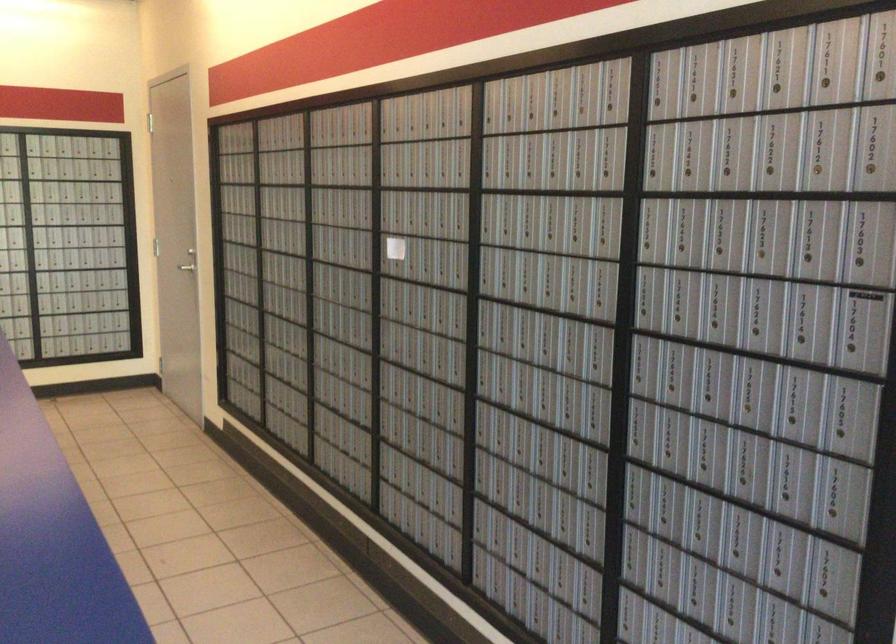
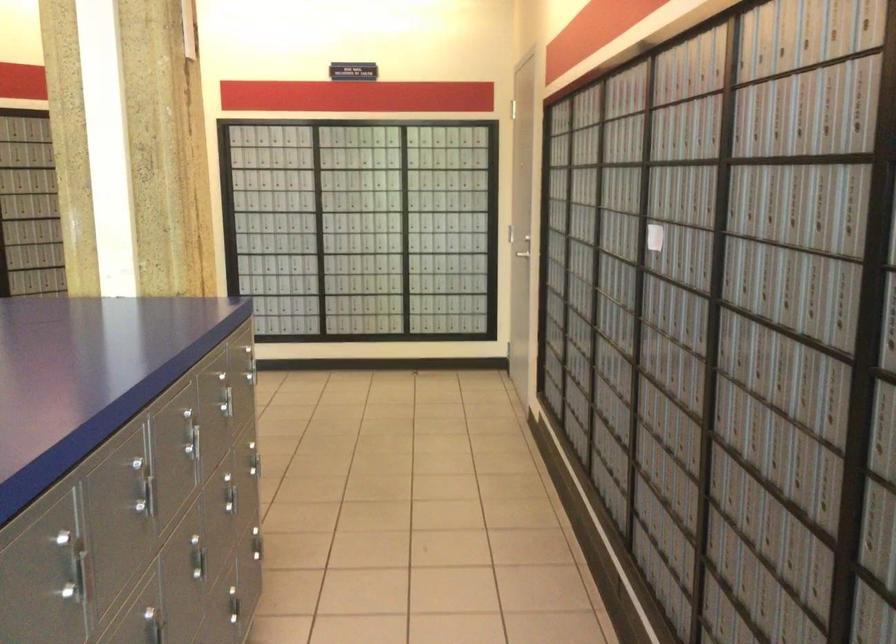
What movement of the cameraman would produce the second image?

The cameraman moved toward right, forward.